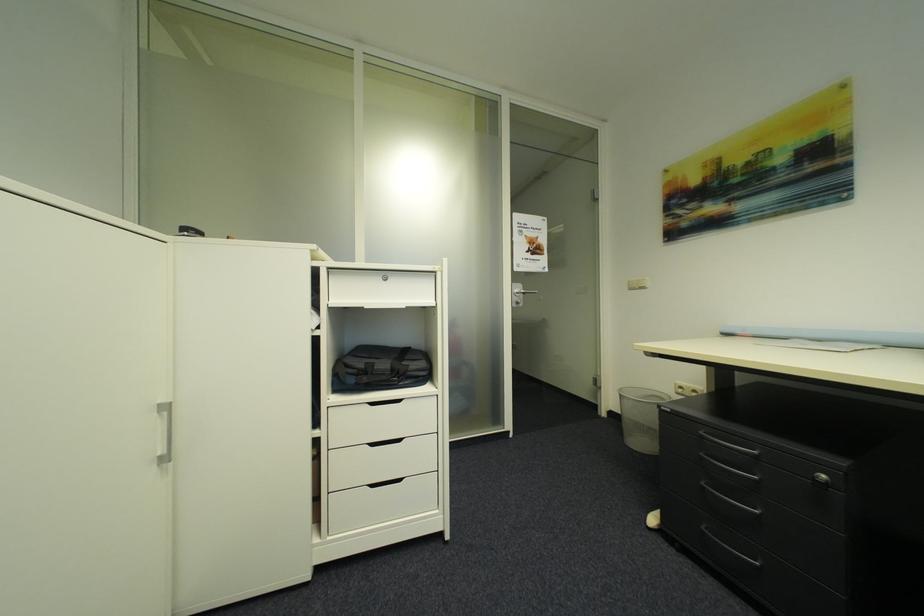
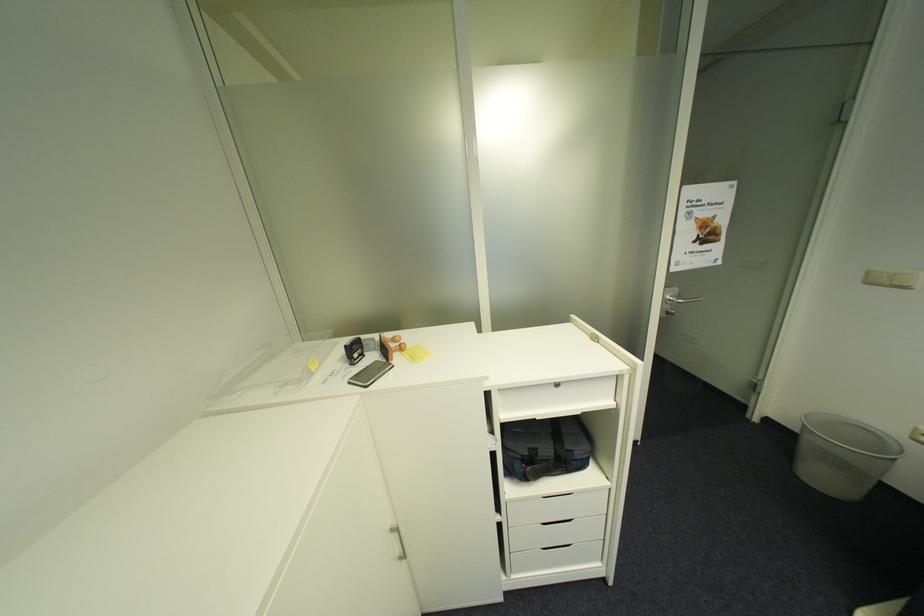
Based on the photo, in a continuous first-person perspective shot, in which direction is the camera moving?

The cameraman moved toward left, forward.